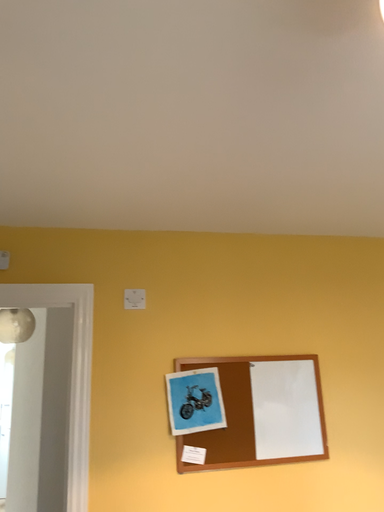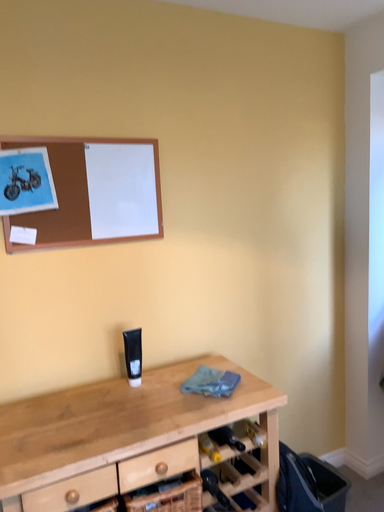
Question: How did the camera likely rotate when shooting the video?

Choices:
 (A) rotated right
 (B) rotated left

Answer: (A)